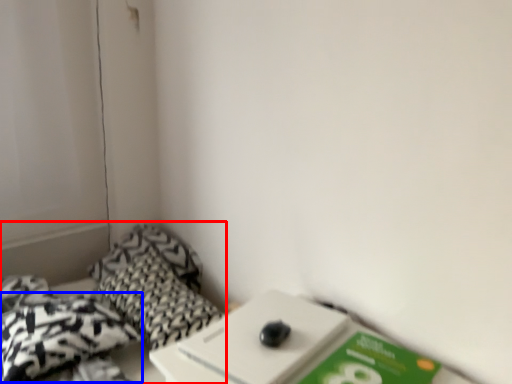
Question: Which of the following is the closest to the observer, bed (highlighted by a red box) or throw pillow (highlighted by a blue box)?

Choices:
 (A) bed
 (B) throw pillow

Answer: (A)